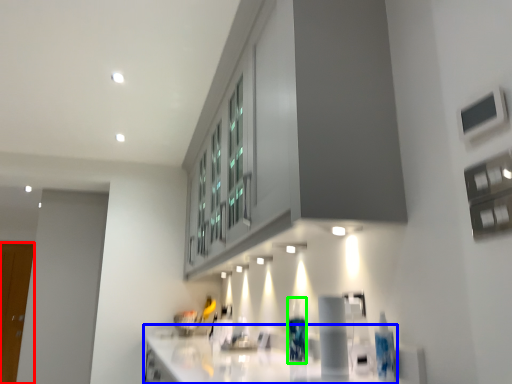
Question: Estimate the real-world distances between objects in this image. Which object is farther from glass door (highlighted by a red box), countertop (highlighted by a blue box) or bottle (highlighted by a green box)?

Choices:
 (A) countertop
 (B) bottle

Answer: (B)